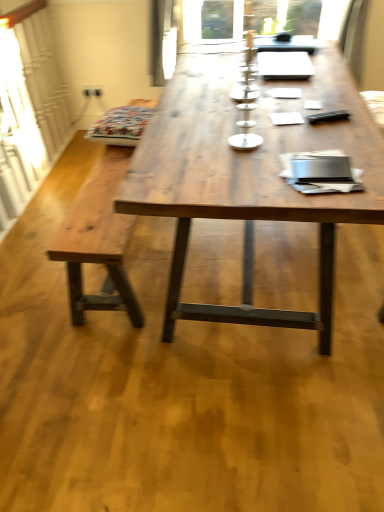
Locate an element on the screen. This screenshot has height=512, width=384. wooden bench at left is located at coordinates (98, 240).

What do you see at coordinates (249, 178) in the screenshot? The width and height of the screenshot is (384, 512). I see `wooden table at center` at bounding box center [249, 178].

At what (x,y) coordinates should I click in order to perform the action: click on wooden bench at left. Please return your answer as a coordinate pair (x, y). This screenshot has width=384, height=512. Looking at the image, I should click on (98, 240).

From a real-world perspective, is wooden table at center above or below wooden bench at left?

In terms of real-world spatial position, wooden table at center is above wooden bench at left.

Visually, is wooden table at center positioned to the left or to the right of wooden bench at left?

Based on their positions, wooden table at center is located to the right of wooden bench at left.

Is wooden table at center far from wooden bench at left?

No, there isn't a large distance between wooden table at center and wooden bench at left.

Is patterned fabric cushion at left inside or outside of wooden table at center?

patterned fabric cushion at left is spatially situated outside wooden table at center.

Is patterned fabric cushion at left far from wooden table at center?

No.

Which is in front, point (137, 117) or point (328, 324)?

Point (328, 324)

Is wooden table at center oriented away from patterned fabric cushion at left?

No, wooden table at center's orientation is not away from patterned fabric cushion at left.

Based on their positions, is wooden table at center located to the left or right of patterned fabric cushion at left?

Based on their positions, wooden table at center is located to the right of patterned fabric cushion at left.

In the scene shown: Does wooden table at center have a lesser height compared to patterned fabric cushion at left?

Incorrect, the height of wooden table at center does not fall short of that of patterned fabric cushion at left.

Is wooden table at center beside patterned fabric cushion at left?

wooden table at center and patterned fabric cushion at left are not in contact.

How different are the orientations of patterned fabric cushion at left and wooden bench at left in degrees?

175 degrees separate the facing orientations of patterned fabric cushion at left and wooden bench at left.

Find the location of a particular element. This screenshot has height=512, width=384. bench located underneath the patterned fabric cushion at left (from a real-world perspective) is located at coordinates (98, 240).

Is patterned fabric cushion at left looking in the opposite direction of wooden bench at left?

patterned fabric cushion at left is not turned away from wooden bench at left.

Does patterned fabric cushion at left appear on the right side of wooden bench at left?

No.

Which object is positioned more to the right, wooden bench at left or wooden table at center?

Positioned to the right is wooden table at center.

From a real-world perspective, is wooden bench at left positioned under wooden table at center based on gravity?

Indeed, from a real-world perspective, wooden bench at left is positioned beneath wooden table at center.

Are wooden bench at left and wooden table at center making contact?

No, wooden bench at left is not beside wooden table at center.

Would you say wooden bench at left is outside patterned fabric cushion at left?

That's correct, wooden bench at left is outside of patterned fabric cushion at left.

Which is more to the left, wooden bench at left or patterned fabric cushion at left?

From the viewer's perspective, patterned fabric cushion at left appears more on the left side.

Considering the points (95, 181) and (121, 124), which point is behind, point (95, 181) or point (121, 124)?

The point (121, 124) is behind.

The width and height of the screenshot is (384, 512). In order to click on bench below the wooden table at center (from the image's perspective) in this screenshot , I will do `click(98, 240)`.

Identify the location of swivel chair above the wooden table at center (from the image's perspective). The height and width of the screenshot is (512, 384). (121, 125).

Considering their positions, is patterned fabric cushion at left positioned further to wooden table at center than wooden bench at left?

patterned fabric cushion at left is positioned further to the anchor wooden table at center.

Looking at the image, which one is located further to wooden table at center, wooden bench at left or patterned fabric cushion at left?

patterned fabric cushion at left is positioned further to the anchor wooden table at center.

Which object lies nearer to the anchor point wooden bench at left, wooden table at center or patterned fabric cushion at left?

patterned fabric cushion at left is positioned closer to the anchor wooden bench at left.

Considering their positions, is wooden bench at left positioned further to patterned fabric cushion at left than wooden table at center?

The object further to patterned fabric cushion at left is wooden table at center.

When comparing their distances from wooden bench at left, does patterned fabric cushion at left or wooden table at center seem further?

wooden table at center lies further to wooden bench at left than the other object.

Which object lies nearer to the anchor point patterned fabric cushion at left, wooden table at center or wooden bench at left?

wooden bench at left lies closer to patterned fabric cushion at left than the other object.

Identify the location of bench located between wooden table at center and patterned fabric cushion at left in the depth direction. The height and width of the screenshot is (512, 384). [x=98, y=240].